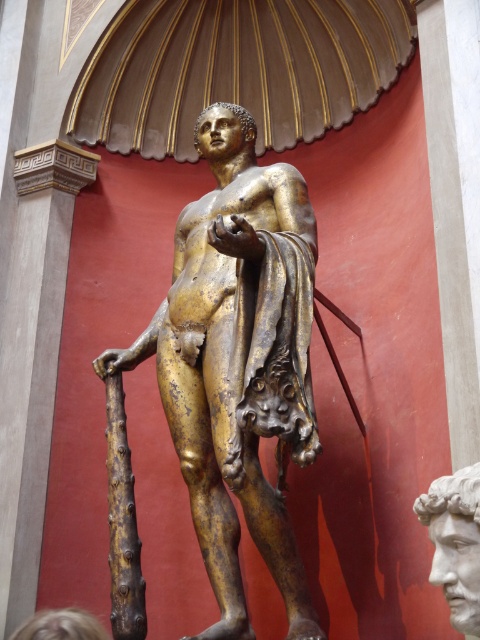
Can you confirm if gold-bronze statue at center is taller than white marble head at center?

Indeed, gold-bronze statue at center has a greater height compared to white marble head at center.

Where is `gold-bronze statue at center`? gold-bronze statue at center is located at coordinates (239, 362).